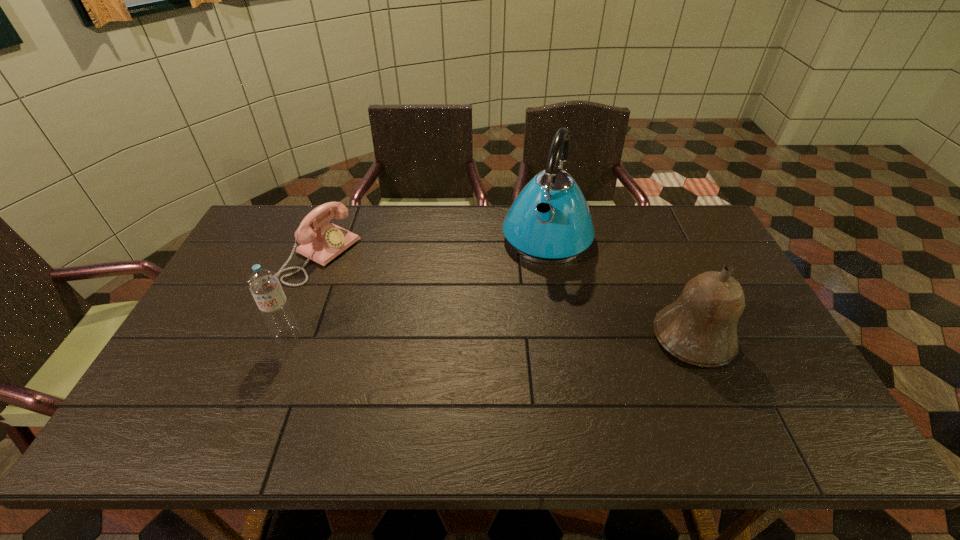
Where is `empty location between the rightmost object and the tallest object`? This screenshot has width=960, height=540. empty location between the rightmost object and the tallest object is located at coordinates (620, 287).

The image size is (960, 540). Identify the location of free space between the water bottle and the third object from left to right. (418, 287).

Identify the location of free space between the telephone and the tallest object. The image size is (960, 540). (434, 246).

At what (x,y) coordinates should I click in order to perform the action: click on unoccupied position between the water bottle and the kettle. Please return your answer as a coordinate pair (x, y). Image resolution: width=960 pixels, height=540 pixels. Looking at the image, I should click on (418, 287).

Find the location of a particular element. The image size is (960, 540). vacant area that lies between the bell and the telephone is located at coordinates [507, 296].

Locate an element on the screen. The image size is (960, 540). object that is the closest to the second object from right to left is located at coordinates (700, 327).

Identify which object is the third nearest to the water bottle. Please provide its 2D coordinates. Your answer should be formatted as a tuple, i.e. [(x, y)], where the tuple contains the x and y coordinates of a point satisfying the conditions above.

[(700, 327)]

Where is `free spot that satisfies the following two spatial constraints: 1. on the back side of the kettle; 2. on the left side of the shortest object`? The height and width of the screenshot is (540, 960). free spot that satisfies the following two spatial constraints: 1. on the back side of the kettle; 2. on the left side of the shortest object is located at coordinates (328, 237).

Image resolution: width=960 pixels, height=540 pixels. I want to click on free space in the image that satisfies the following two spatial constraints: 1. on the back side of the water bottle; 2. on the left side of the third object from left to right, so click(327, 237).